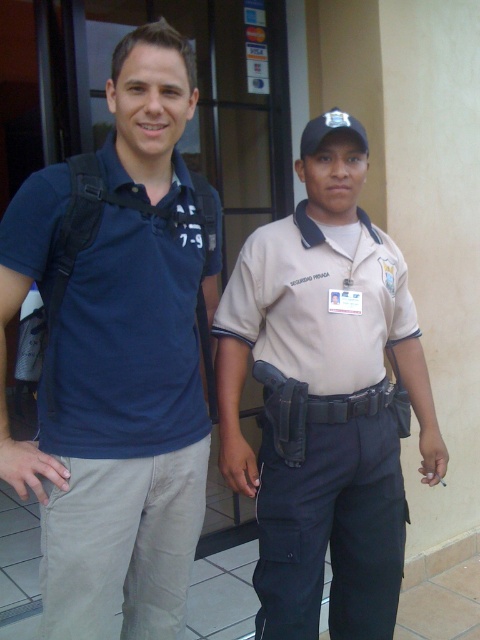
You are a photographer trying to capture a group photo of the matte blue shirt at left and the tan fabric shirt at center. Since you want both subjects to be centered in the frame, which direction should you move the camera to align them properly?

The matte blue shirt at left is positioned on the left side of tan fabric shirt at center, so to center both subjects in the frame, move the camera slightly to the left so that the tan fabric shirt at center moves towards the center of the frame and the matte blue shirt at left shifts into the desired position.

You are designing a new layout for a clothing store display. You have two shirts to place on a mannequin stand. The matte blue shirt at left is narrower than the tan fabric shirt at center. Which shirt should you place on the narrower mannequin arm to ensure proper fit?

The matte blue shirt at left has a lesser width compared to the tan fabric shirt at center, so it should be placed on the narrower mannequin arm to ensure proper fit.

You are a delivery person standing at point (x=126, y=433). You need to deliver a package to the person wearing a dark blue polo shirt with a logo on the chest. Is the person wearing the matte blue shirt at left the correct recipient?

Yes, the person wearing the matte blue shirt at left is the correct recipient because the matte blue shirt at left is located at point (x=126, y=433).